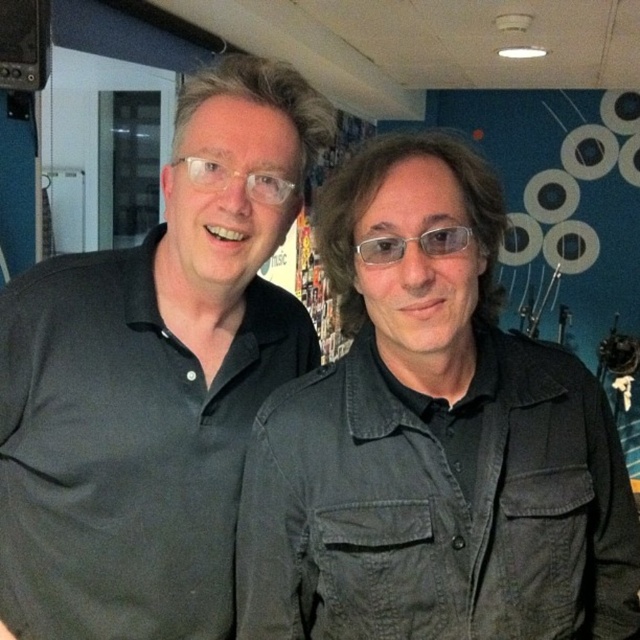
Who is more forward, (x=353, y=259) or (x=196, y=196)?

Point (x=353, y=259) is more forward.

Who is more forward, (308,419) or (257,378)?

Point (308,419) is more forward.

Image resolution: width=640 pixels, height=640 pixels. What are the coordinates of `matte black jacket at center` in the screenshot? It's located at (433, 444).

Is matte black jacket at center in front of transparent plastic glasses at center?

Yes, matte black jacket at center is in front of transparent plastic glasses at center.

Is matte black jacket at center bigger than transparent plastic glasses at center?

Indeed, matte black jacket at center has a larger size compared to transparent plastic glasses at center.

Does point (602, 388) come behind point (388, 236)?

That is True.

At what (x,y) coordinates should I click in order to perform the action: click on matte black jacket at center. Please return your answer as a coordinate pair (x, y). Looking at the image, I should click on (433, 444).

Can you confirm if dark gray shirt at center is shorter than transparent plastic glasses at center?

In fact, dark gray shirt at center may be taller than transparent plastic glasses at center.

Does point (186, 358) lie in front of point (458, 237)?

No.

Is point (83, 465) closer to viewer compared to point (442, 250)?

No.

The image size is (640, 640). Identify the location of dark gray shirt at center. (152, 381).